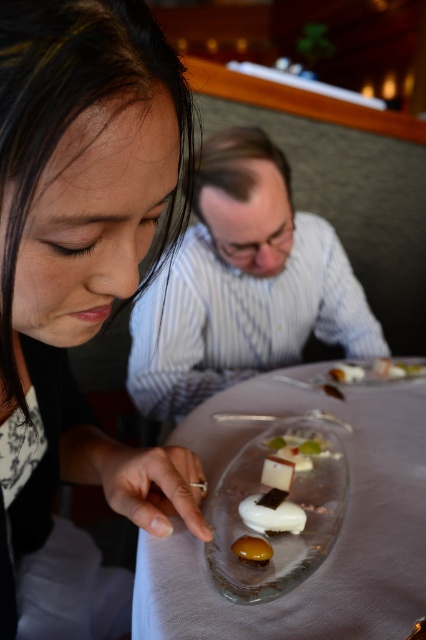
Is translucent glass platter at center thinner than white glossy dessert at center?

Incorrect, translucent glass platter at center's width is not less than white glossy dessert at center's.

Which is in front, point (399, 378) or point (345, 364)?

Positioned in front is point (399, 378).

Does point (342, 365) come in front of point (348, 364)?

Yes, point (342, 365) is closer to viewer.

At what (x,y) coordinates should I click in order to perform the action: click on translucent glass platter at center. Please return your answer as a coordinate pair (x, y). The height and width of the screenshot is (640, 426). Looking at the image, I should click on (374, 371).

Who is more distant from viewer, [207,448] or [386,362]?

Point [386,362]

Locate an element on the screen. Image resolution: width=426 pixels, height=640 pixels. clear glass plate at center is located at coordinates coord(339,534).

Where is `transparent glass plate at center`? The image size is (426, 640). transparent glass plate at center is located at coordinates (287, 499).

Is transparent glass plate at center above white glossy cube at center?

Correct, transparent glass plate at center is located above white glossy cube at center.

Does point (296, 536) lie in front of point (278, 509)?

Yes, point (296, 536) is closer to viewer.

What are the coordinates of `transparent glass plate at center` in the screenshot? It's located at (287, 499).